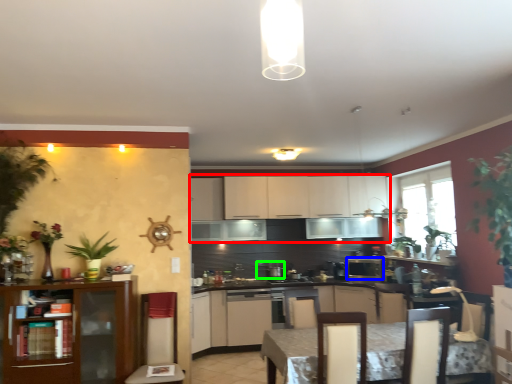
Question: Estimate the real-world distances between objects in this image. Which object is farther from cabinetry (highlighted by a red box), kitchen appliance (highlighted by a blue box) or appliance (highlighted by a green box)?

Choices:
 (A) kitchen appliance
 (B) appliance

Answer: (A)